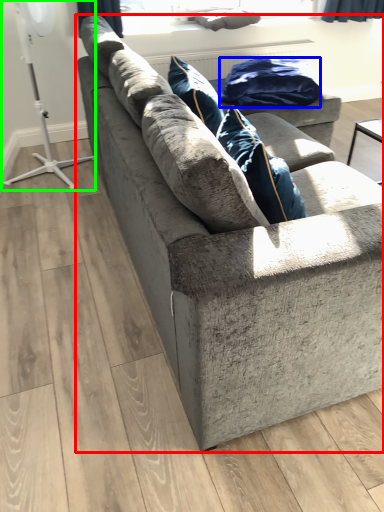
Question: Considering the real-world distances, which object is closest to studio couch (highlighted by a red box)? material (highlighted by a blue box) or fan (highlighted by a green box).

Choices:
 (A) material
 (B) fan

Answer: (A)